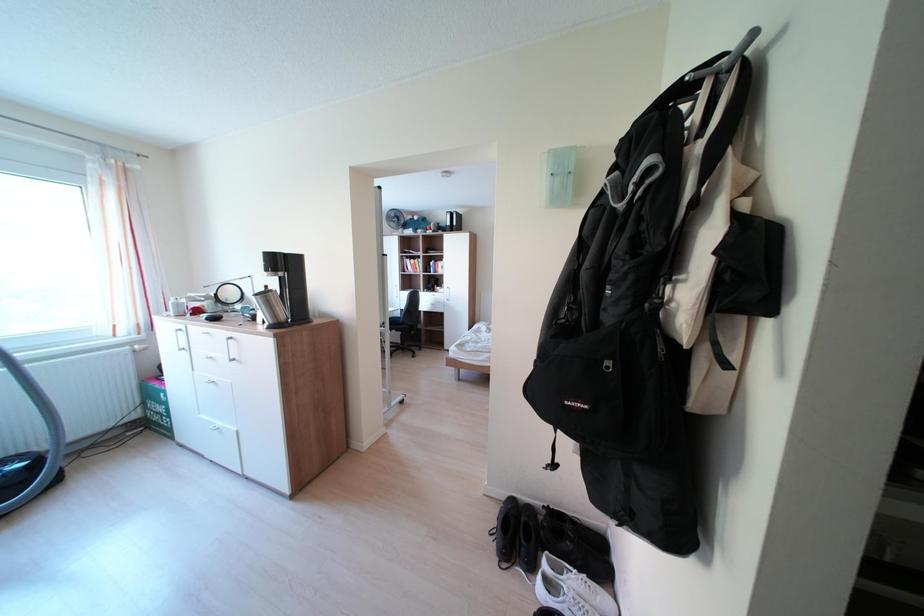
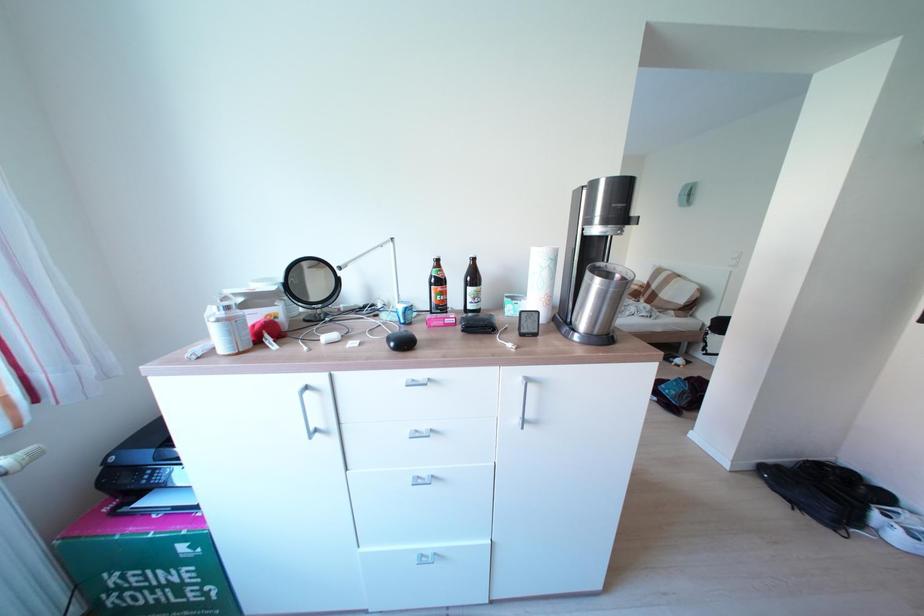
In a continuous first-person perspective shot, in which direction is the camera moving?

The cameraman moved toward left, forward.